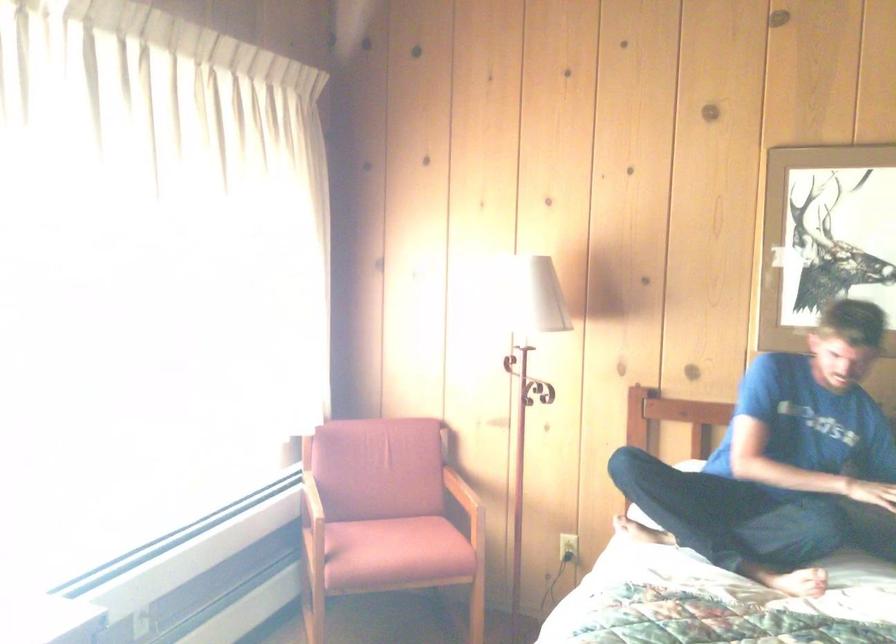
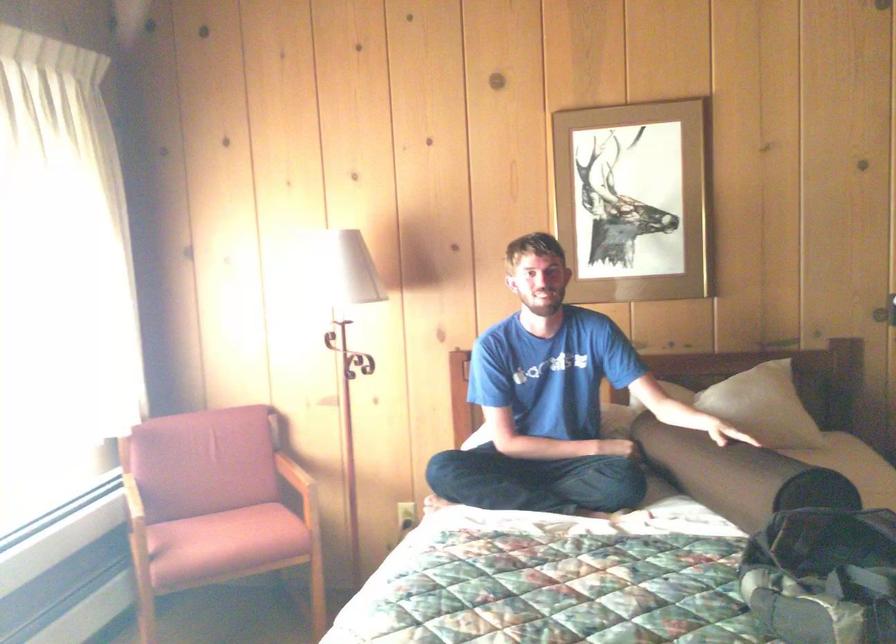
Question: How did the camera likely rotate?

Choices:
 (A) Left
 (B) Right
 (C) Up
 (D) Down

Answer: (B)